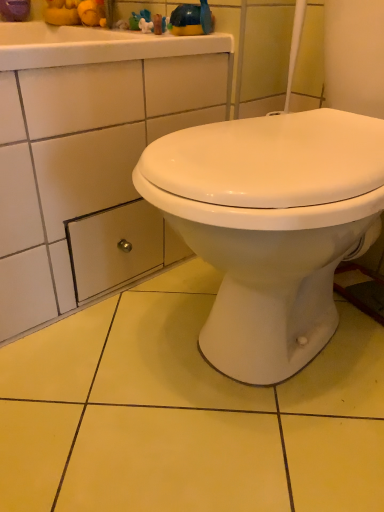
Identify the location of metallic silver drawer at lower left. (113, 247).

What do you see at coordinates (113, 247) in the screenshot? I see `metallic silver drawer at lower left` at bounding box center [113, 247].

Locate an element on the screen. This screenshot has width=384, height=512. blue rubber duck at upper center is located at coordinates (191, 20).

Describe the element at coordinates (191, 20) in the screenshot. This screenshot has width=384, height=512. I see `blue rubber duck at upper center` at that location.

This screenshot has height=512, width=384. In order to click on metallic silver drawer at lower left in this screenshot , I will do `click(113, 247)`.

In the image, is blue rubber duck at upper center on the left side or the right side of metallic silver drawer at lower left?

blue rubber duck at upper center is positioned on metallic silver drawer at lower left's right side.

Considering the positions of objects blue rubber duck at upper center and metallic silver drawer at lower left in the image provided, who is in front, blue rubber duck at upper center or metallic silver drawer at lower left?

metallic silver drawer at lower left is closer to the camera.

Does point (178, 32) lie in front of point (73, 283)?

Yes, it is in front of point (73, 283).

From the image's perspective, is blue rubber duck at upper center located above or below metallic silver drawer at lower left?

blue rubber duck at upper center is situated higher than metallic silver drawer at lower left in the image.

From a real-world perspective, is blue rubber duck at upper center above or below metallic silver drawer at lower left?

blue rubber duck at upper center is situated higher than metallic silver drawer at lower left in the real world.

Does blue rubber duck at upper center have a greater width compared to metallic silver drawer at lower left?

In fact, blue rubber duck at upper center might be narrower than metallic silver drawer at lower left.

Can you confirm if blue rubber duck at upper center is shorter than metallic silver drawer at lower left?

Yes.

Based on their sizes in the image, would you say blue rubber duck at upper center is bigger or smaller than metallic silver drawer at lower left?

blue rubber duck at upper center is smaller than metallic silver drawer at lower left.

Does blue rubber duck at upper center contain metallic silver drawer at lower left?

No, metallic silver drawer at lower left is not inside blue rubber duck at upper center.

Can you see blue rubber duck at upper center touching metallic silver drawer at lower left?

No, blue rubber duck at upper center is not with metallic silver drawer at lower left.

Is blue rubber duck at upper center aimed at metallic silver drawer at lower left?

No, blue rubber duck at upper center is not aimed at metallic silver drawer at lower left.

How far apart are blue rubber duck at upper center and metallic silver drawer at lower left?

The distance of blue rubber duck at upper center from metallic silver drawer at lower left is 18.46 inches.

Find the location of a particular element. This screenshot has height=512, width=384. toy on the right of metallic silver drawer at lower left is located at coordinates (191, 20).

Can you confirm if metallic silver drawer at lower left is positioned to the right of blue rubber duck at upper center?

In fact, metallic silver drawer at lower left is to the left of blue rubber duck at upper center.

Relative to blue rubber duck at upper center, is metallic silver drawer at lower left in front or behind?

metallic silver drawer at lower left is in front of blue rubber duck at upper center.

Looking at this image, which is closer, [130,229] or [190,19]?

Point [130,229] is positioned farther from the camera compared to point [190,19].

From the image's perspective, is metallic silver drawer at lower left over blue rubber duck at upper center?

No.

From a real-world perspective, is metallic silver drawer at lower left located higher than blue rubber duck at upper center?

No, from a real-world perspective, metallic silver drawer at lower left is not above blue rubber duck at upper center.

Is metallic silver drawer at lower left wider or thinner than blue rubber duck at upper center?

Clearly, metallic silver drawer at lower left has more width compared to blue rubber duck at upper center.

In terms of height, does metallic silver drawer at lower left look taller or shorter compared to blue rubber duck at upper center?

In the image, metallic silver drawer at lower left appears to be taller than blue rubber duck at upper center.

Does metallic silver drawer at lower left have a smaller size compared to blue rubber duck at upper center?

No, metallic silver drawer at lower left is not smaller than blue rubber duck at upper center.

Is metallic silver drawer at lower left completely or partially outside of blue rubber duck at upper center?

Yes, metallic silver drawer at lower left is not within blue rubber duck at upper center.

Is metallic silver drawer at lower left far from blue rubber duck at upper center?

That's not correct — metallic silver drawer at lower left is a little close to blue rubber duck at upper center.

Is metallic silver drawer at lower left facing away from blue rubber duck at upper center?

No.

Can you tell me how much metallic silver drawer at lower left and blue rubber duck at upper center differ in facing direction?

90 degrees separate the facing orientations of metallic silver drawer at lower left and blue rubber duck at upper center.

Find the location of a particular element. The height and width of the screenshot is (512, 384). drawer below the blue rubber duck at upper center (from the image's perspective) is located at coordinates (113, 247).

Where is `drawer in front of the blue rubber duck at upper center`? The width and height of the screenshot is (384, 512). drawer in front of the blue rubber duck at upper center is located at coordinates (113, 247).

You are a GUI agent. You are given a task and a screenshot of the screen. Output one action in this format:
    pyautogui.click(x=<x>, y=<y>)
    Task: Click on the toy behind the metallic silver drawer at lower left
    This screenshot has width=384, height=512.
    Given the screenshot: What is the action you would take?
    click(191, 20)